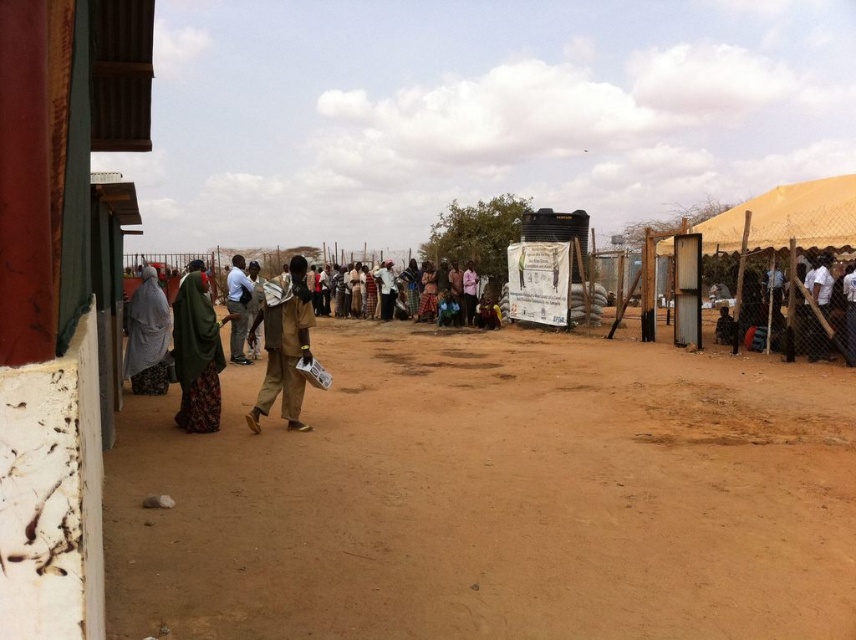
Question: Does green fabric headscarf at center appear on the left side of gray fabric headscarf at left?

Choices:
 (A) yes
 (B) no

Answer: (B)

Question: Does green fabric headscarf at center appear on the right side of brown fabric shirt at center?

Choices:
 (A) yes
 (B) no

Answer: (A)

Question: Which of the following is the farthest from the observer?

Choices:
 (A) (597, 624)
 (B) (260, 388)

Answer: (B)

Question: Is green fabric headscarf at center wider than gray fabric headscarf at left?

Choices:
 (A) no
 (B) yes

Answer: (A)

Question: Which object is closer to the camera taking this photo?

Choices:
 (A) brown sandy ground at center
 (B) gray fabric headscarf at left

Answer: (A)

Question: Which of these objects is positioned farthest from the brown fabric bag at center?

Choices:
 (A) rustic wood hut at left
 (B) gray fabric headscarf at left
 (C) brown sandy ground at center
 (D) green fabric headscarf at center

Answer: (A)